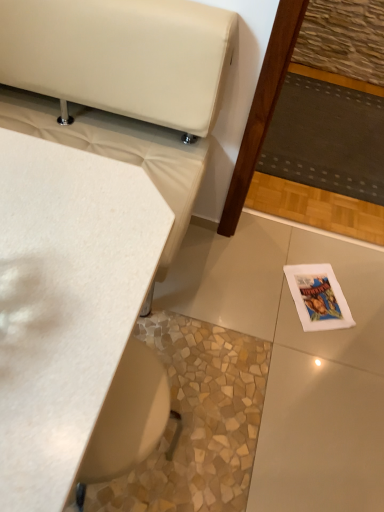
This screenshot has width=384, height=512. What do you see at coordinates (318, 297) in the screenshot?
I see `white paper magazine at lower right` at bounding box center [318, 297].

Locate an element on the screen. white matte table at upper left is located at coordinates (71, 316).

The image size is (384, 512). Identify the location of white paper magazine at lower right. (318, 297).

Considering the positions of point (379, 179) and point (297, 266), is point (379, 179) closer or farther from the camera than point (297, 266)?

Point (379, 179) appears to be farther away from the viewer than point (297, 266).

Is dark gray fabric mat at center right with white paper magazine at lower right?

There is a gap between dark gray fabric mat at center right and white paper magazine at lower right.

Locate an element on the screen. magazine below the dark gray fabric mat at center right (from the image's perspective) is located at coordinates (318, 297).

Where is `table below the white paper magazine at lower right (from the image's perspective)`? The width and height of the screenshot is (384, 512). table below the white paper magazine at lower right (from the image's perspective) is located at coordinates (71, 316).

From a real-world perspective, relative to white matte table at upper left, is white paper magazine at lower right vertically above or below?

In terms of real-world spatial position, white paper magazine at lower right is below white matte table at upper left.

Does point (333, 295) come behind point (89, 305)?

Yes, it is behind point (89, 305).

Is white paper magazine at lower right in front of or behind white matte table at upper left in the image?

Clearly, white paper magazine at lower right is behind white matte table at upper left.

From a real-world perspective, who is located higher, white matte table at upper left or dark gray fabric mat at center right?

white matte table at upper left, from a real-world perspective.

Is the surface of white matte table at upper left in direct contact with dark gray fabric mat at center right?

No, white matte table at upper left is not touching dark gray fabric mat at center right.

In terms of size, does white matte table at upper left appear bigger or smaller than dark gray fabric mat at center right?

white matte table at upper left is bigger than dark gray fabric mat at center right.

I want to click on mat on the right of white paper magazine at lower right, so click(327, 138).

From a real-world perspective, is white paper magazine at lower right beneath dark gray fabric mat at center right?

Indeed, from a real-world perspective, white paper magazine at lower right is positioned beneath dark gray fabric mat at center right.

Is white paper magazine at lower right not close to dark gray fabric mat at center right?

No, white paper magazine at lower right is in close proximity to dark gray fabric mat at center right.

Which is more to the right, dark gray fabric mat at center right or white matte table at upper left?

From the viewer's perspective, dark gray fabric mat at center right appears more on the right side.

Between dark gray fabric mat at center right and white matte table at upper left, which one has smaller size?

With smaller size is dark gray fabric mat at center right.

From a real-world perspective, who is located higher, dark gray fabric mat at center right or white matte table at upper left?

white matte table at upper left is physically above.

From the image's perspective, would you say dark gray fabric mat at center right is positioned over white matte table at upper left?

Indeed, from the image's perspective, dark gray fabric mat at center right is shown above white matte table at upper left.

Is white matte table at upper left in contact with white paper magazine at lower right?

white matte table at upper left is not next to white paper magazine at lower right, and they're not touching.

Looking at the image, does white matte table at upper left seem bigger or smaller compared to white paper magazine at lower right?

Considering their sizes, white matte table at upper left takes up more space than white paper magazine at lower right.

Image resolution: width=384 pixels, height=512 pixels. Find the location of `magazine that is under the white matte table at upper left (from a real-world perspective)`. magazine that is under the white matte table at upper left (from a real-world perspective) is located at coordinates (318, 297).

Is white matte table at upper left positioned with its back to white paper magazine at lower right?

No, white matte table at upper left's orientation is not away from white paper magazine at lower right.

Locate an element on the screen. Image resolution: width=384 pixels, height=512 pixels. mat behind the white paper magazine at lower right is located at coordinates (327, 138).

The width and height of the screenshot is (384, 512). What are the coordinates of `table that appears on the left of white paper magazine at lower right` in the screenshot? It's located at (71, 316).

Which object lies nearer to the anchor point white matte table at upper left, white paper magazine at lower right or dark gray fabric mat at center right?

Based on the image, white paper magazine at lower right appears to be nearer to white matte table at upper left.

Estimate the real-world distances between objects in this image. Which object is closer to white matte table at upper left, dark gray fabric mat at center right or white paper magazine at lower right?

white paper magazine at lower right is positioned closer to the anchor white matte table at upper left.

From the image, which object appears to be farther from white paper magazine at lower right, white matte table at upper left or dark gray fabric mat at center right?

Among the two, white matte table at upper left is located further to white paper magazine at lower right.

Estimate the real-world distances between objects in this image. Which object is further from dark gray fabric mat at center right, white matte table at upper left or white paper magazine at lower right?

white matte table at upper left is further to dark gray fabric mat at center right.

Which object lies further to the anchor point white paper magazine at lower right, dark gray fabric mat at center right or white matte table at upper left?

Among the two, white matte table at upper left is located further to white paper magazine at lower right.

Which object lies nearer to the anchor point dark gray fabric mat at center right, white paper magazine at lower right or white matte table at upper left?

white paper magazine at lower right.

Find the location of a particular element. magazine located between white matte table at upper left and dark gray fabric mat at center right in the depth direction is located at coordinates (318, 297).